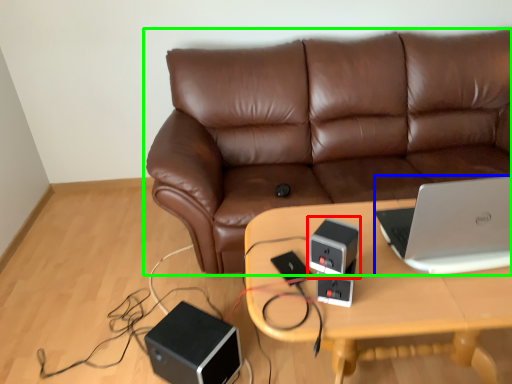
Question: Considering the real-world distances, which object is farthest from speaker (highlighted by a red box)? laptop (highlighted by a blue box) or studio couch (highlighted by a green box)?

Choices:
 (A) laptop
 (B) studio couch

Answer: (B)